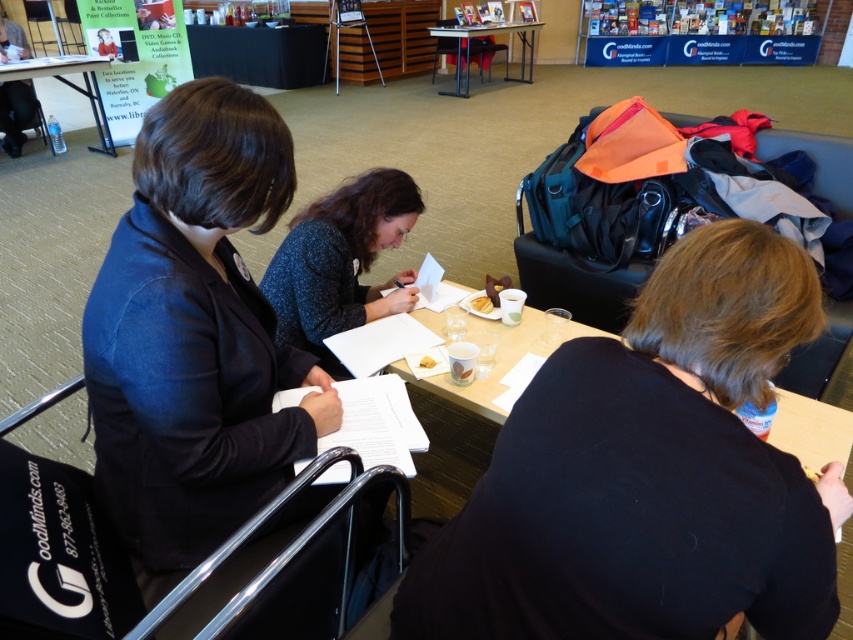
Question: Which point is farther from the camera taking this photo?

Choices:
 (A) (508, 22)
 (B) (91, 80)
 (C) (427, 368)
 (D) (807, 257)

Answer: (A)

Question: In this image, where is metallic silver table at upper center located relative to white paper napkin at center?

Choices:
 (A) above
 (B) below

Answer: (A)

Question: Can you confirm if black matte shirt at center is smaller than white paper plate at center?

Choices:
 (A) yes
 (B) no

Answer: (B)

Question: Among these objects, which one is farthest from the camera?

Choices:
 (A) white paper napkin at center
 (B) metallic silver table at upper center
 (C) white paper plate at center

Answer: (B)

Question: Which object is closer to the camera taking this photo?

Choices:
 (A) white paper napkin at center
 (B) metallic silver table at upper center
 (C) white paper plate at center

Answer: (C)

Question: Can you confirm if metallic silver table at upper center is bigger than white paper plate at center?

Choices:
 (A) no
 (B) yes

Answer: (B)